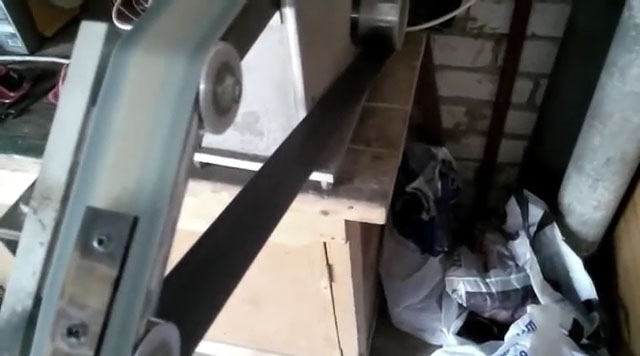
At what (x,y) coordinates should I click in order to perform the action: click on mounting plate. Please return your answer as a coordinate pair (x, y). Image resolution: width=640 pixels, height=356 pixels. Looking at the image, I should click on (95, 290).